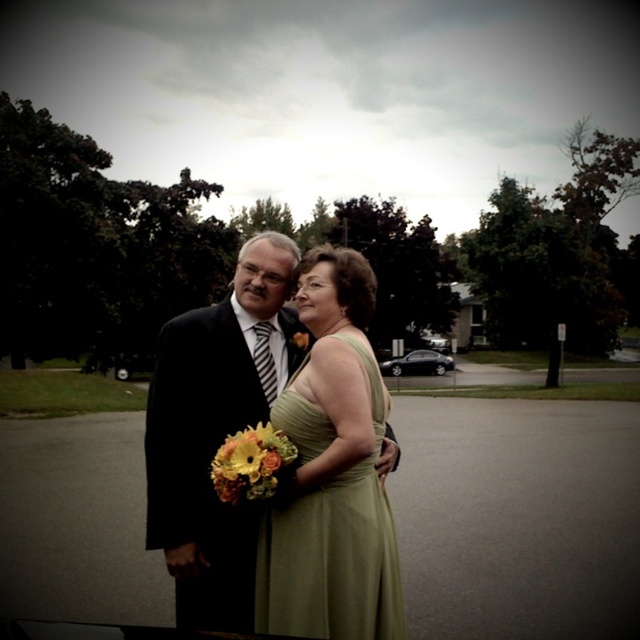
You are a photographer setting up for a group photo. You need to ensure that the green satin dress at center and the matte black suit at center are both visible in the frame. Given their sizes, which one might require more space to accommodate its width?

The matte black suit at center requires more space to accommodate its width because it has a greater width than the green satin dress at center.

You are a photographer trying to capture a clear shot of both the matte black suit at center and the vibrant floral bouquet at center. Since both are at the center, which one is positioned to the left?

The matte black suit at center is to the left of the vibrant floral bouquet at center, so the matte black suit at center is positioned to the left.

You are a photographer trying to capture a clear photo of both the matte black suit at center and the yellow fabric flower at center. Which object should you focus on first to ensure both are in focus?

The matte black suit at center is wider than the yellow fabric flower at center, so focusing on the wider matte black suit at center first would help ensure both are in focus.